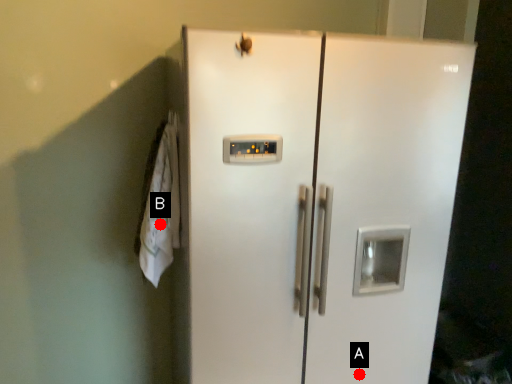
Question: Two points are circled on the image, labeled by A and B beside each circle. Which of the following is the closest to the observer?

Choices:
 (A) A is closer
 (B) B is closer

Answer: (B)